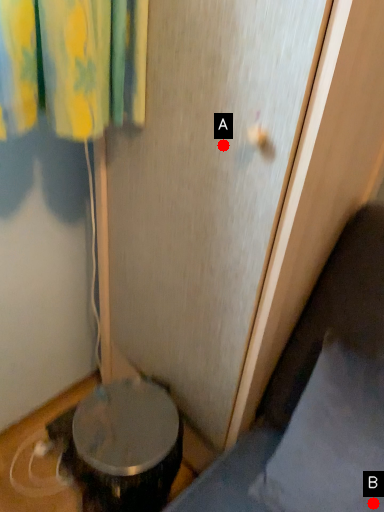
Question: Two points are circled on the image, labeled by A and B beside each circle. Which point appears closest to the camera in this image?

Choices:
 (A) A is closer
 (B) B is closer

Answer: (A)